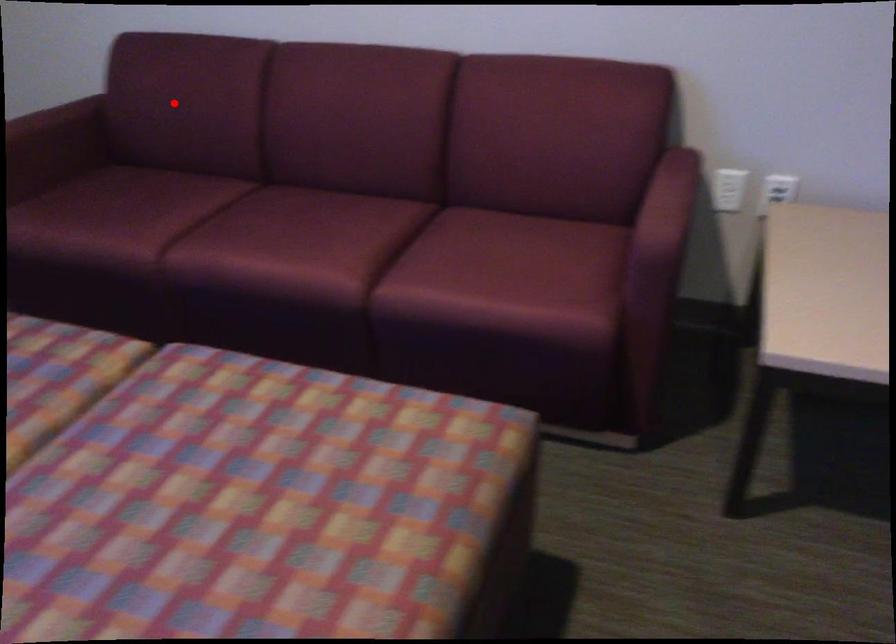
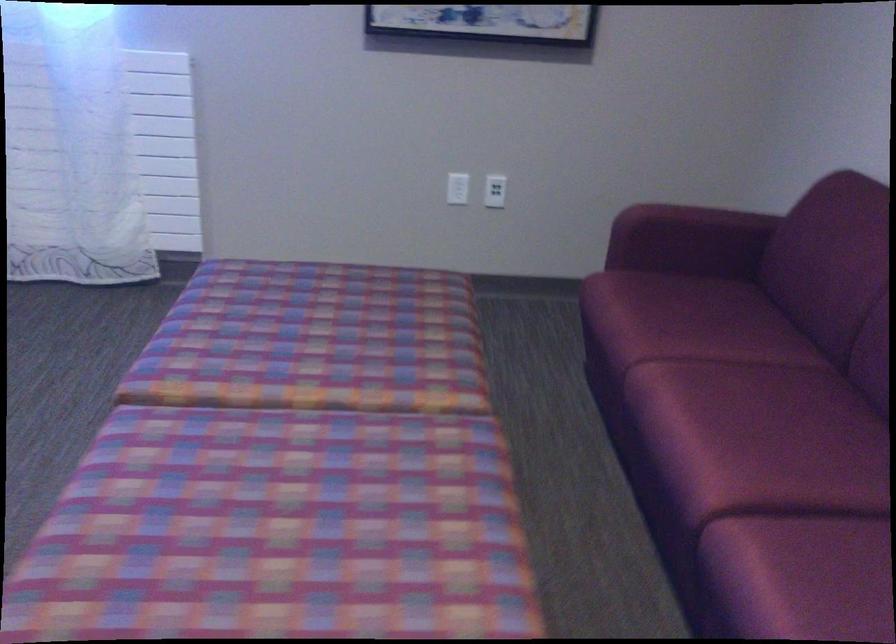
Question: I am providing you with two images of the same scene from different viewpoints. Image1 has a red point marked. In image2, the corresponding 3D location appears at what relative position? Reply with the corresponding letter.

Choices:
 (A) Closer
 (B) Farther

Answer: (A)